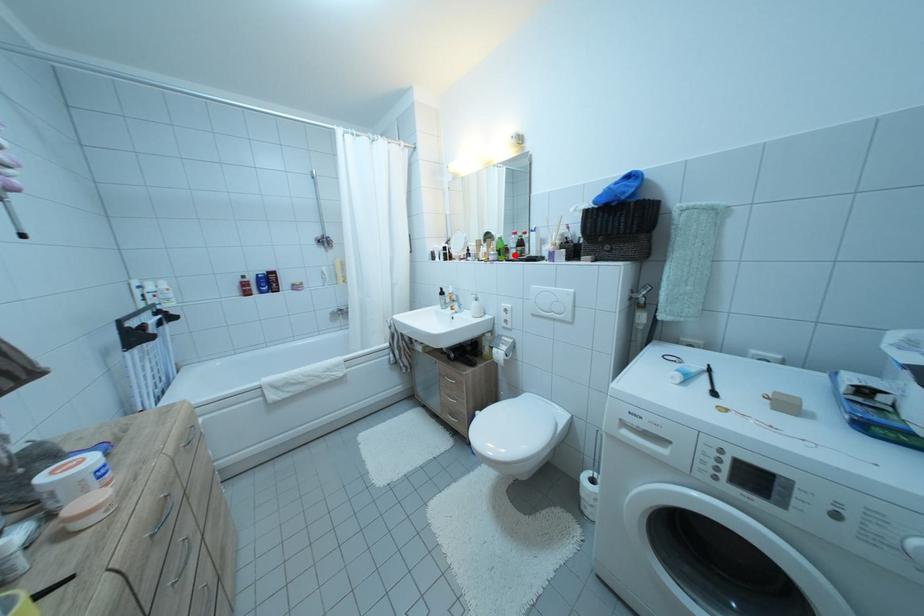
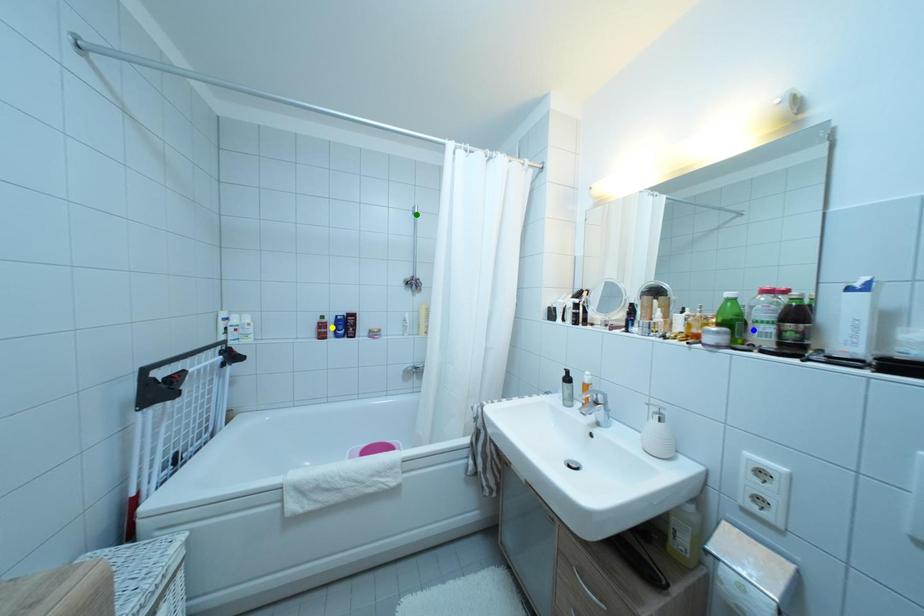
Question: I am providing you with two images of the same scene from different viewpoints. A red point is marked on the first image. You are given multiple points on the second image. Which spot in image 2 lines up with the point in image 1?

Choices:
 (A) yellow point
 (B) green point
 (C) blue point

Answer: (C)